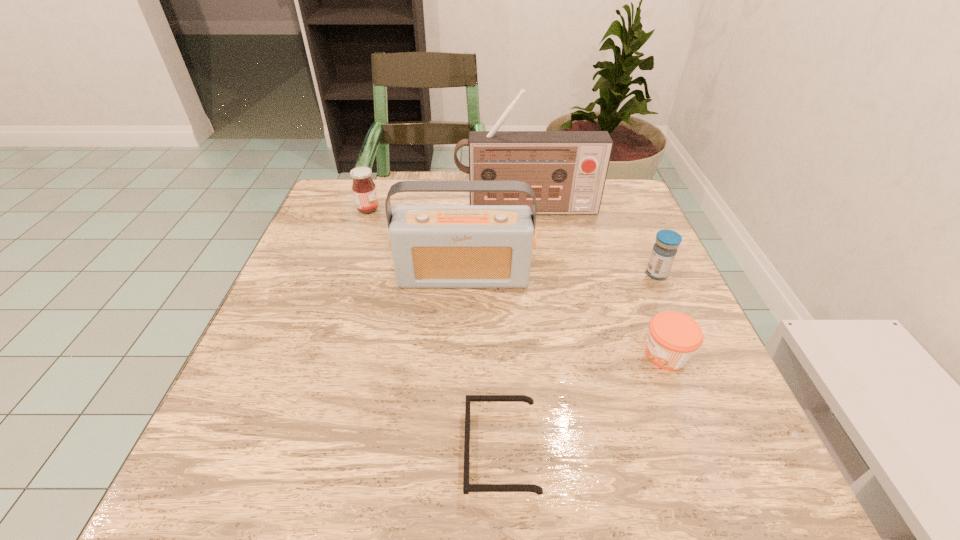
Locate an element on the screen. This screenshot has width=960, height=540. the fourth closest object relative to the sunglasses is located at coordinates (567, 170).

I want to click on object that is the third closest to the fifth shortest object, so click(x=673, y=338).

Identify the location of free space that satisfies the following two spatial constraints: 1. on the label side of the leftmost object; 2. on the right side of the medicine. (346, 274).

This screenshot has height=540, width=960. In order to click on vacant point that satisfies the following two spatial constraints: 1. on the label side of the medicine; 2. on the left side of the taller jam in this screenshot , I will do `click(346, 274)`.

Where is `vacant region that satisfies the following two spatial constraints: 1. on the front side of the medicine; 2. on the front-facing side of the nearest object`? The image size is (960, 540). vacant region that satisfies the following two spatial constraints: 1. on the front side of the medicine; 2. on the front-facing side of the nearest object is located at coordinates (735, 450).

What are the coordinates of `free spot that satisfies the following two spatial constraints: 1. on the front panel of the taller radio receiver; 2. on the front-facing side of the nearest object` in the screenshot? It's located at (561, 450).

Where is `vacant region that satisfies the following two spatial constraints: 1. on the label side of the leftmost object; 2. on the back side of the medicine`? This screenshot has width=960, height=540. vacant region that satisfies the following two spatial constraints: 1. on the label side of the leftmost object; 2. on the back side of the medicine is located at coordinates (346, 274).